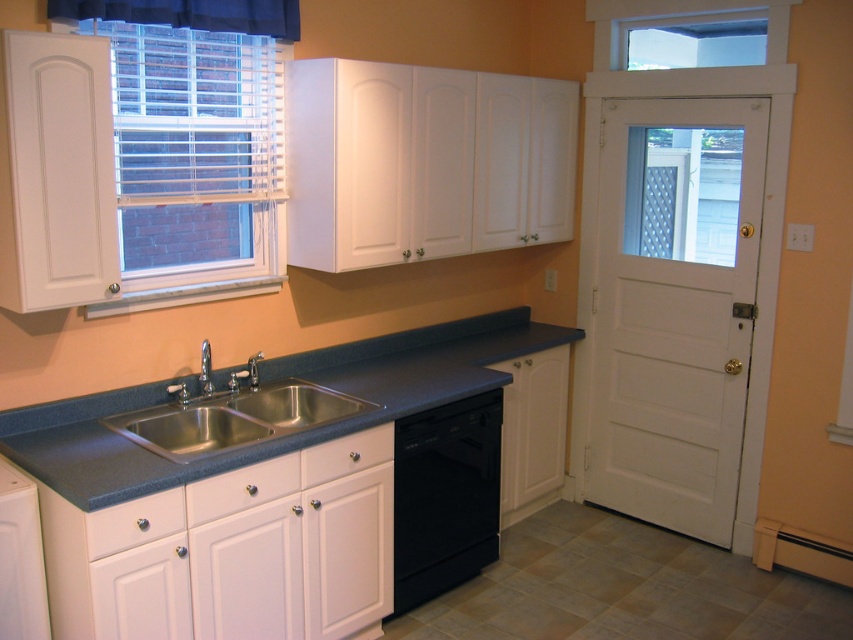
Is point (447, 444) more distant than point (222, 12)?

Yes, point (447, 444) is behind point (222, 12).

Can you confirm if black matte dishwasher at lower center is thinner than black fabric curtain at upper left?

Indeed, black matte dishwasher at lower center has a lesser width compared to black fabric curtain at upper left.

Which is in front, point (463, 544) or point (97, 8)?

Point (97, 8) is in front.

Find the location of a particular element. black matte dishwasher at lower center is located at coordinates (445, 497).

Does white glossy cabinet at lower left lie behind satin nickel faucet at sink left?

That is False.

Consider the image. Is white glossy cabinet at lower left positioned before satin nickel faucet at sink left?

That is True.

Who is more forward, (38, 579) or (201, 372)?

Point (38, 579) is in front.

Identify the location of white glossy cabinet at lower left. This screenshot has height=640, width=853. (20, 557).

Is point (212, 140) positioned in front of point (30, 508)?

No, it is behind (30, 508).

Locate an element on the screen. This screenshot has width=853, height=640. white blinds at upper left is located at coordinates (195, 156).

Between point (144, 170) and point (3, 531), which one is positioned behind?

The point (144, 170) is more distant.

The width and height of the screenshot is (853, 640). Find the location of `white blinds at upper left`. white blinds at upper left is located at coordinates (195, 156).